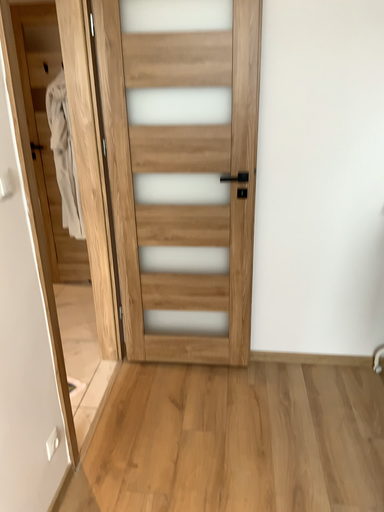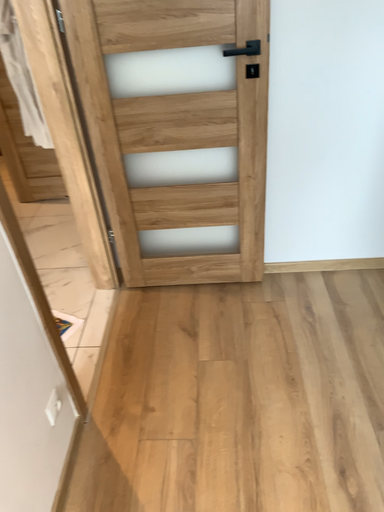
Question: Which way did the camera rotate in the video?

Choices:
 (A) rotated upward
 (B) rotated downward

Answer: (B)